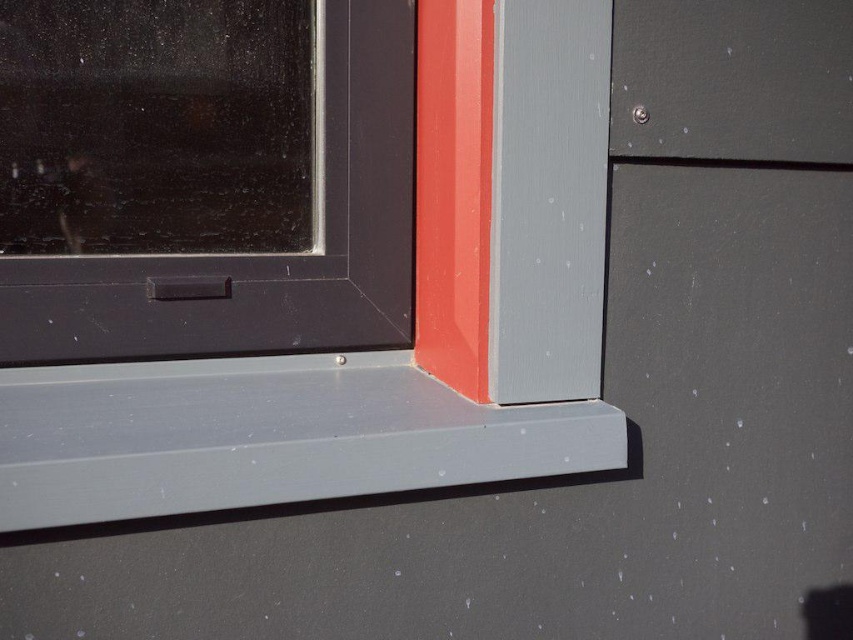
Question: Is matte plastic window frame at lower right above matte gray plastic at lower center?

Choices:
 (A) yes
 (B) no

Answer: (A)

Question: Can you confirm if matte plastic window frame at lower right is wider than matte black window at upper left?

Choices:
 (A) yes
 (B) no

Answer: (A)

Question: Is matte plastic window frame at lower right below matte black window at upper left?

Choices:
 (A) no
 (B) yes

Answer: (B)

Question: Which object appears farthest from the camera in this image?

Choices:
 (A) matte plastic window frame at lower right
 (B) matte black window at upper left
 (C) matte gray plastic at lower center

Answer: (B)

Question: Which point is closer to the camera?

Choices:
 (A) (381, 8)
 (B) (265, 384)

Answer: (B)

Question: Considering the real-world distances, which object is closest to the matte black window at upper left?

Choices:
 (A) matte gray plastic at lower center
 (B) matte plastic window frame at lower right

Answer: (B)